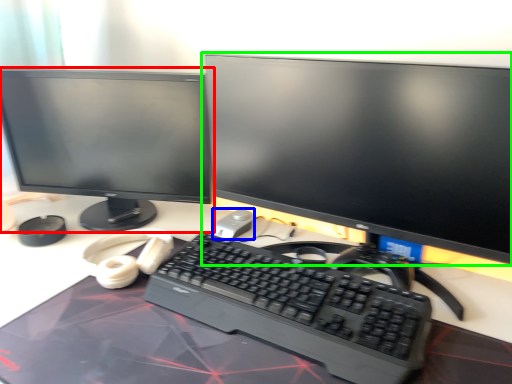
Question: Which object is positioned farthest from computer monitor (highlighted by a red box)? Select from mouse (highlighted by a blue box) and computer monitor (highlighted by a green box).

Choices:
 (A) mouse
 (B) computer monitor

Answer: (A)